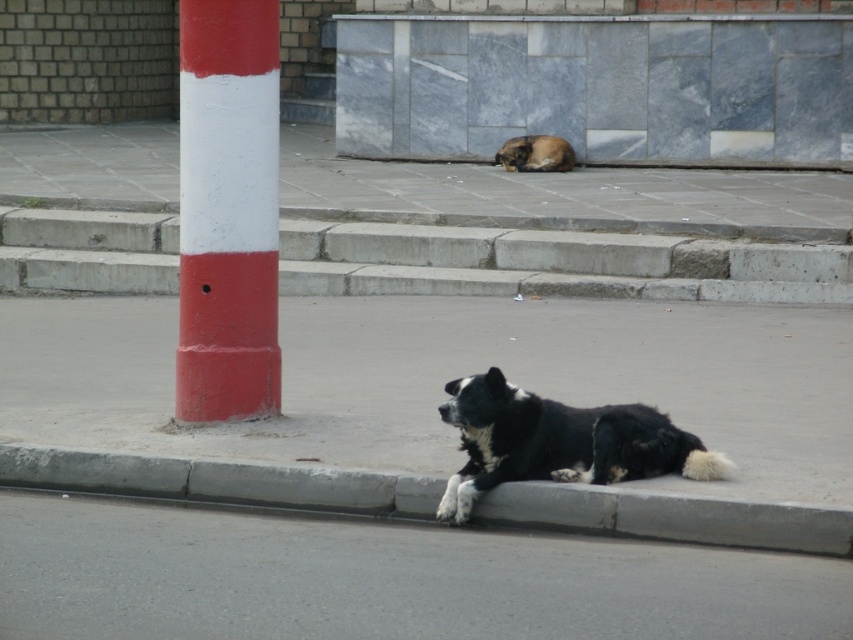
Question: Is gray concrete pavement at lower center positioned before black fur dog at lower center?

Choices:
 (A) no
 (B) yes

Answer: (A)

Question: Is concrete stairs at center to the left of black fur dog at lower center from the viewer's perspective?

Choices:
 (A) yes
 (B) no

Answer: (B)

Question: Is concrete stairs at center above gray concrete curb at lower center?

Choices:
 (A) yes
 (B) no

Answer: (A)

Question: Which is nearer to the red/white painted pole at left?

Choices:
 (A) brown fur dog at center
 (B) gray concrete pavement at lower center
 (C) black fur dog at lower center

Answer: (B)

Question: Considering the real-world distances, which object is closest to the concrete stairs at center?

Choices:
 (A) red/white painted pole at left
 (B) brown fur dog at center
 (C) gray concrete curb at lower center
 (D) black fur dog at lower center

Answer: (B)

Question: Which is nearer to the black fur dog at lower center?

Choices:
 (A) gray concrete pavement at lower center
 (B) red/white painted pole at left
 (C) brown fur dog at center

Answer: (B)